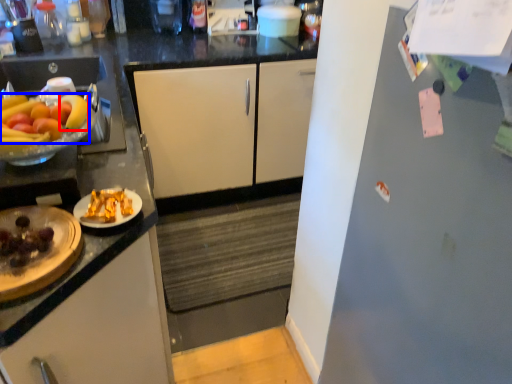
Question: Which object appears closest to the camera in this image, banana (highlighted by a red box) or grapefruit (highlighted by a blue box)?

Choices:
 (A) banana
 (B) grapefruit

Answer: (B)